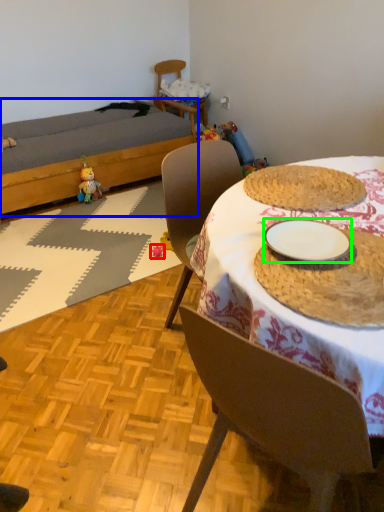
Question: Which object is positioned farthest from toy (highlighted by a red box)? Select from bed (highlighted by a blue box) and plate (highlighted by a green box).

Choices:
 (A) bed
 (B) plate

Answer: (B)